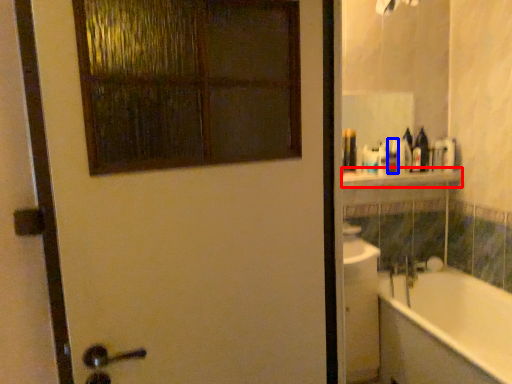
Question: Which object appears closest to the camera in this image, balustrade (highlighted by a red box) or toiletry (highlighted by a blue box)?

Choices:
 (A) balustrade
 (B) toiletry

Answer: (A)